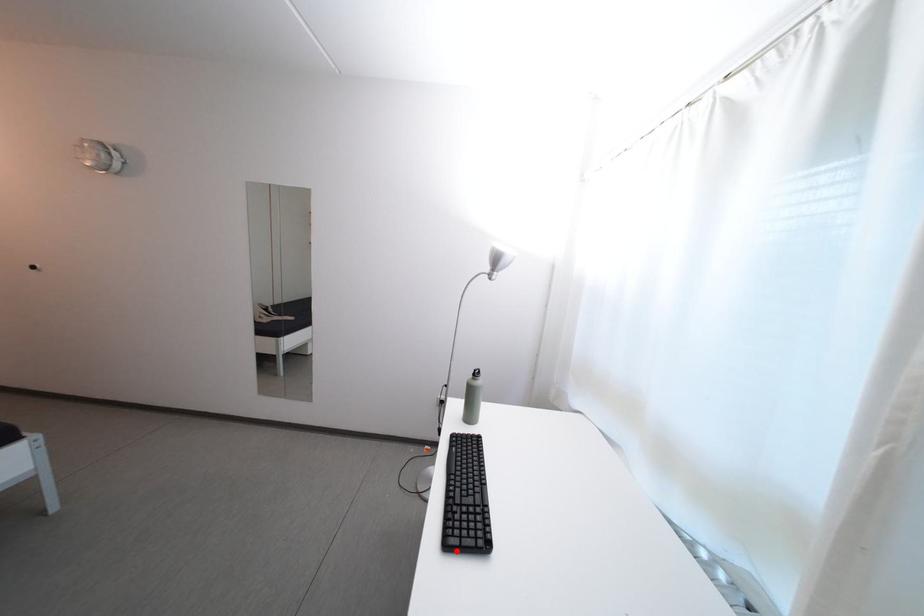
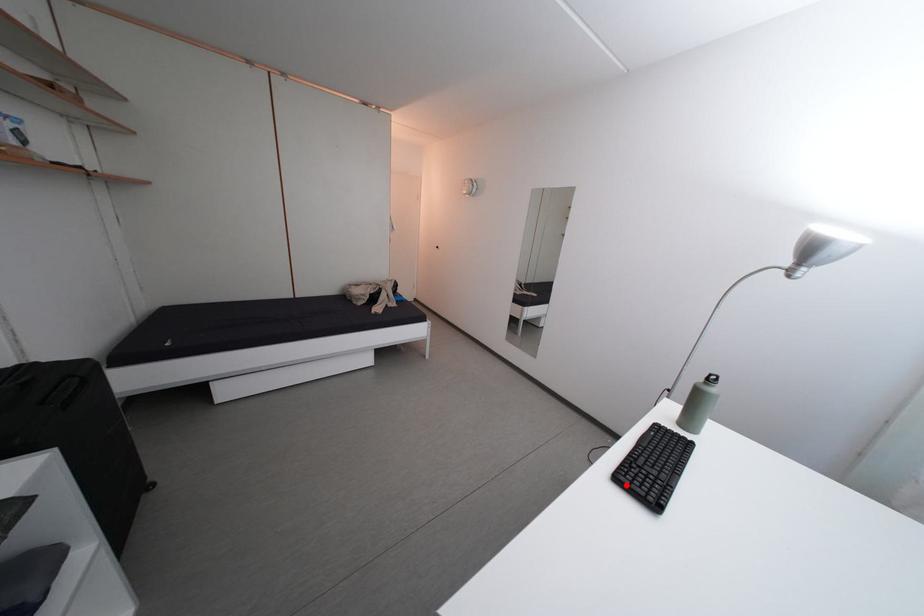
I am providing you with two images of the same scene from different viewpoints. A red point is marked on the first image and another point is marked on the second image. Is the red point in image1 aligned with the point shown in image2?

→ Yes